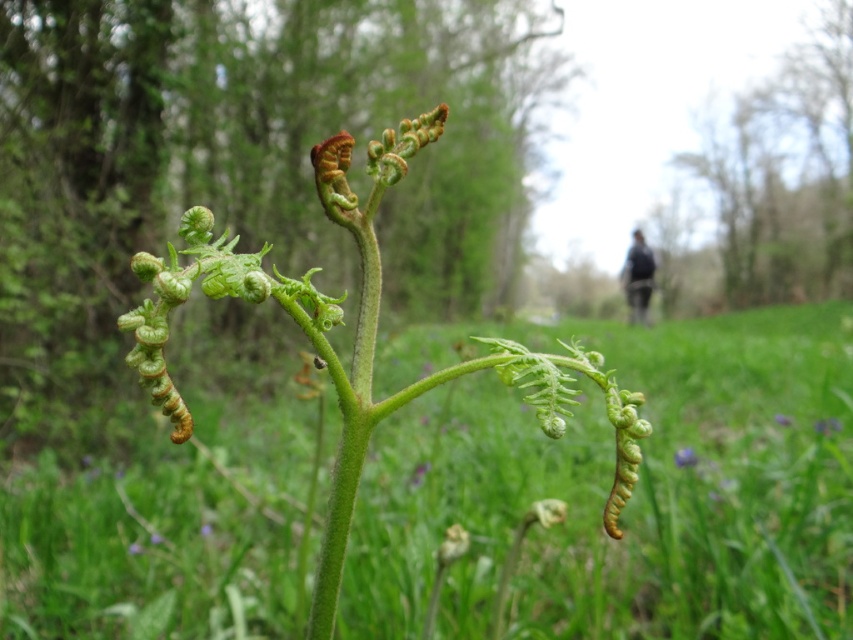
Which is more to the right, green matte fern at center or dark blue jacket at center?

dark blue jacket at center

Between green matte fern at center and dark blue jacket at center, which one has less height?

green matte fern at center is shorter.

Image resolution: width=853 pixels, height=640 pixels. Describe the element at coordinates (631, 493) in the screenshot. I see `green matte fern at center` at that location.

Find the location of a particular element. This screenshot has height=640, width=853. green matte fern at center is located at coordinates (631, 493).

Which is more to the left, purple matte flower at lower center or purple matte flower at center?

purple matte flower at lower center

Looking at this image, between purple matte flower at lower center and purple matte flower at center, which one is positioned higher?

Positioned higher is purple matte flower at center.

Which is in front, point (675, 465) or point (784, 424)?

Positioned in front is point (675, 465).

Identify the location of purple matte flower at lower center. (685, 458).

Which is more to the left, dark blue jacket at center or purple matte flower at center?

purple matte flower at center

Is dark blue jacket at center above purple matte flower at center?

Yes, dark blue jacket at center is above purple matte flower at center.

Where is `dark blue jacket at center`? This screenshot has width=853, height=640. dark blue jacket at center is located at coordinates (637, 278).